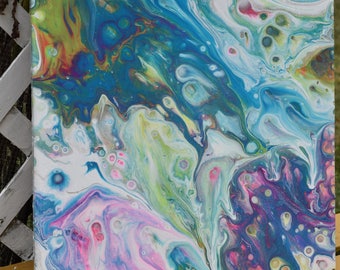
You are a GUI agent. You are given a task and a screenshot of the screen. Output one action in this format:
    pyautogui.click(x=<x>, y=<y>)
    Task: Click on the green paint
    The image size is (340, 270).
    Given the screenshot: What is the action you would take?
    pyautogui.click(x=160, y=202)